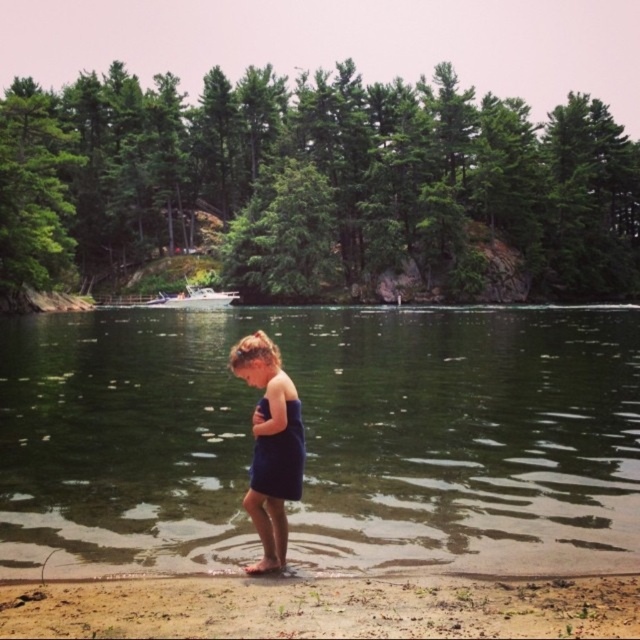
Does point (426, 579) lie in front of point (275, 557)?

Yes, it is.

The width and height of the screenshot is (640, 640). Describe the element at coordinates (323, 608) in the screenshot. I see `sandy shore at lower center` at that location.

Is point (128, 593) positioned before point (266, 392)?

Yes, it is in front of point (266, 392).

Locate an element on the screen. The image size is (640, 640). sandy shore at lower center is located at coordinates (323, 608).

Does point (188, 360) come in front of point (285, 474)?

That is False.

Is point (500, 525) behind point (260, 474)?

Yes, point (500, 525) is farther from viewer.

Describe the element at coordinates (324, 436) in the screenshot. I see `clear water at lower center` at that location.

The width and height of the screenshot is (640, 640). What are the coordinates of `clear water at lower center` in the screenshot? It's located at (324, 436).

Is blue towel at center further to camera compared to blue fabric dress at center?

Yes, blue towel at center is behind blue fabric dress at center.

Where is `blue towel at center`? This screenshot has width=640, height=640. blue towel at center is located at coordinates (269, 445).

The image size is (640, 640). Identify the location of blue towel at center. (269, 445).